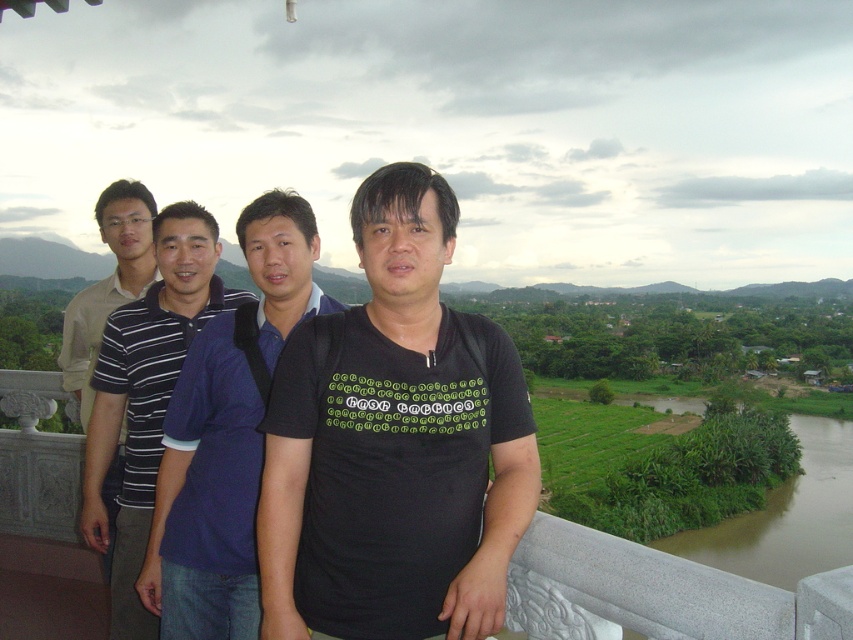
Question: Can you confirm if black matte shirt at center is positioned above blue cotton shirt at center?

Choices:
 (A) yes
 (B) no

Answer: (A)

Question: Which point is farther from the camera taking this photo?

Choices:
 (A) (787, 484)
 (B) (221, 356)

Answer: (A)

Question: Is dark blue polo shirt at center bigger than brown muddy water at lower right?

Choices:
 (A) yes
 (B) no

Answer: (B)

Question: Based on their relative distances, which object is farther from the blue cotton shirt at center?

Choices:
 (A) dark blue polo shirt at center
 (B) striped cotton polo shirt at left

Answer: (B)

Question: Does brown muddy water at lower right appear over striped cotton polo shirt at left?

Choices:
 (A) no
 (B) yes

Answer: (A)

Question: Which point is closer to the camera?

Choices:
 (A) (166, 272)
 (B) (795, 532)
 (C) (125, 234)

Answer: (A)